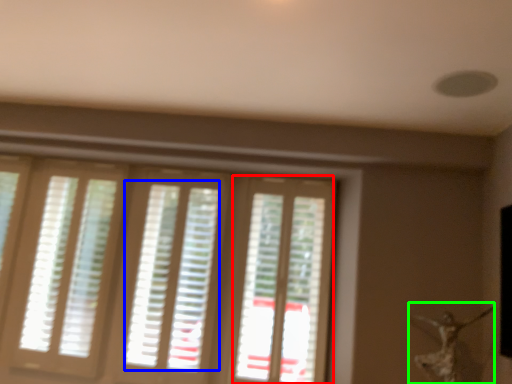
Question: Which is farther away from screen door (highlighted by a red box)? blind (highlighted by a blue box) or woman (highlighted by a green box)?

Choices:
 (A) blind
 (B) woman

Answer: (B)